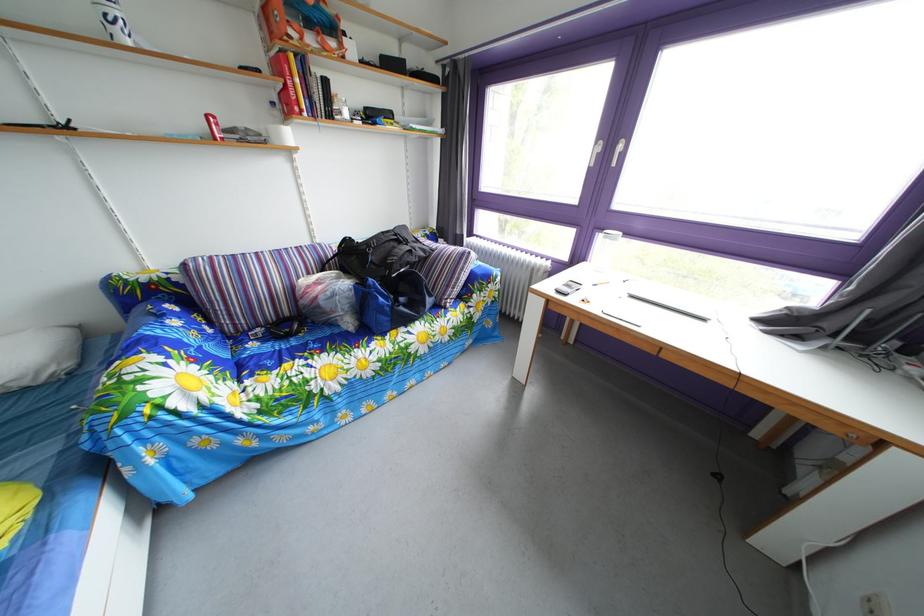
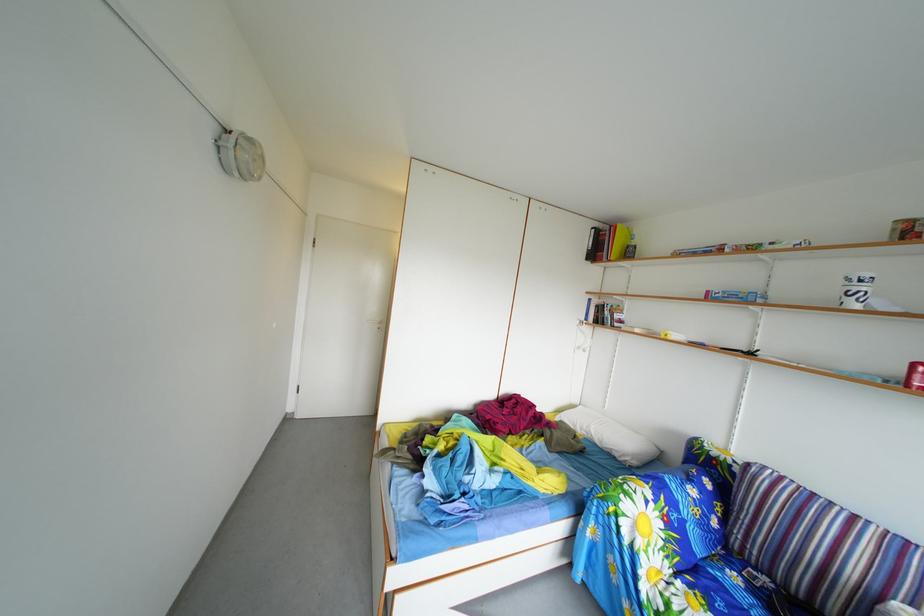
Question: The camera is either moving clockwise (left) or counter-clockwise (right) around the object. The first image is from the beginning of the video and the second image is from the end. Is the camera moving left or right when shooting the video?

Choices:
 (A) Left
 (B) Right

Answer: (B)